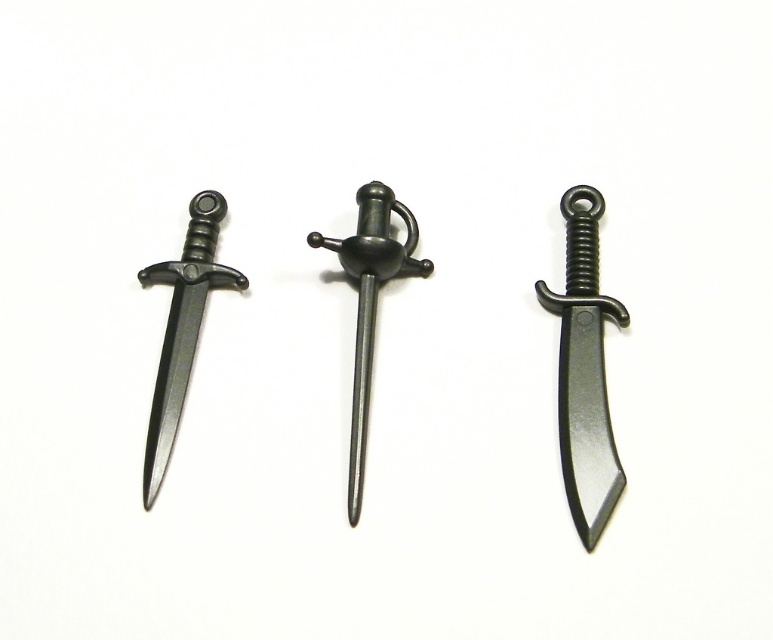
Between black matte dagger at center and matte black blade at center, which one has less height?

matte black blade at center is shorter.

Can you confirm if black matte dagger at center is wider than matte black blade at center?

Indeed, black matte dagger at center has a greater width compared to matte black blade at center.

Between point (577, 264) and point (150, 420), which one is positioned in front?

Point (150, 420) is in front.

Find the location of a particular element. black matte dagger at center is located at coordinates (584, 371).

Is matte black dagger at left below matte black sword at center?

No.

Is matte black dagger at left positioned in front of matte black sword at center?

No, it is not.

In order to click on matte black dagger at left in this screenshot , I will do `click(182, 326)`.

Who is shorter, matte black dagger at left or matte black blade at center?

matte black blade at center

Does matte black dagger at left lie behind matte black blade at center?

Yes, matte black dagger at left is further from the viewer.

Does point (203, 298) come farther from viewer compared to point (181, 337)?

Yes, point (203, 298) is behind point (181, 337).

Locate an element on the screen. Image resolution: width=773 pixels, height=640 pixels. matte black dagger at left is located at coordinates (182, 326).